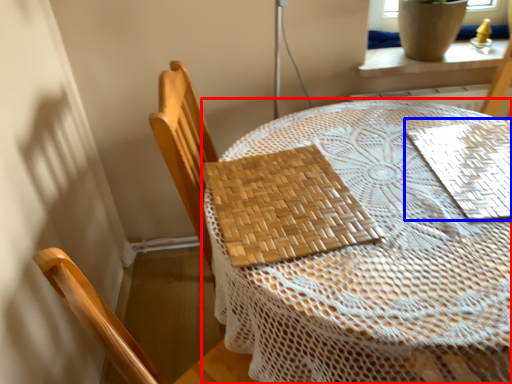
Question: Among these objects, which one is farthest to the camera, table (highlighted by a red box) or mat (highlighted by a blue box)?

Choices:
 (A) table
 (B) mat

Answer: (B)